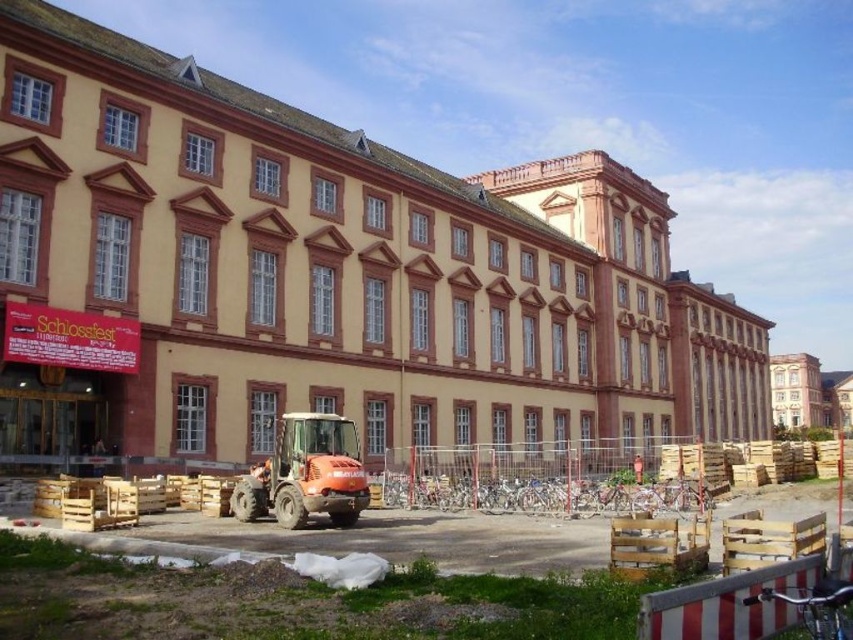
Does beige stone building at center have a lesser height compared to orange compact tractor at center?

In fact, beige stone building at center may be taller than orange compact tractor at center.

Is beige stone building at center below orange compact tractor at center?

No, beige stone building at center is not below orange compact tractor at center.

Which is behind, point (706, 342) or point (708, 624)?

Positioned behind is point (706, 342).

What are the coordinates of `beige stone building at center` in the screenshot? It's located at [323, 278].

From the picture: Does beige stone building at center appear under orange rubber tractor at center?

Actually, beige stone building at center is above orange rubber tractor at center.

Which is in front, point (485, 408) or point (337, 518)?

Positioned in front is point (337, 518).

Where is `beige stone building at center`? Image resolution: width=853 pixels, height=640 pixels. beige stone building at center is located at coordinates (323, 278).

This screenshot has width=853, height=640. Describe the element at coordinates (735, 589) in the screenshot. I see `orange compact tractor at center` at that location.

Does point (422, 538) come in front of point (303, 465)?

Yes, it is.

Where is `orange compact tractor at center`? The image size is (853, 640). orange compact tractor at center is located at coordinates (735, 589).